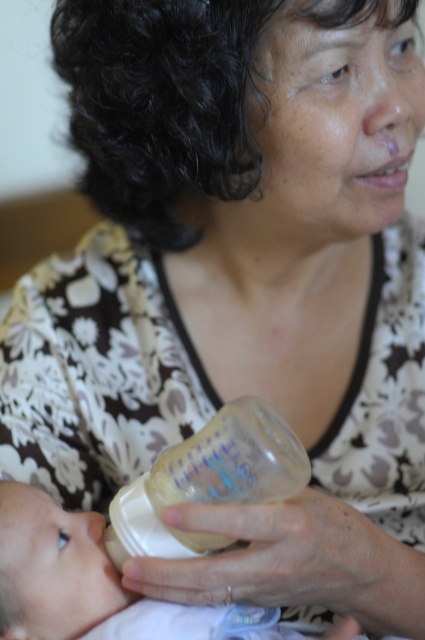
Which is above, transparent plastic bottle at center or smooth beige baby bottle at lower left?

transparent plastic bottle at center is higher up.

Can you confirm if transparent plastic bottle at center is taller than smooth beige baby bottle at lower left?

No, transparent plastic bottle at center is not taller than smooth beige baby bottle at lower left.

Is point (238, 484) less distant than point (27, 596)?

No, (238, 484) is further to viewer.

This screenshot has height=640, width=425. In order to click on transparent plastic bottle at center in this screenshot , I will do `click(207, 481)`.